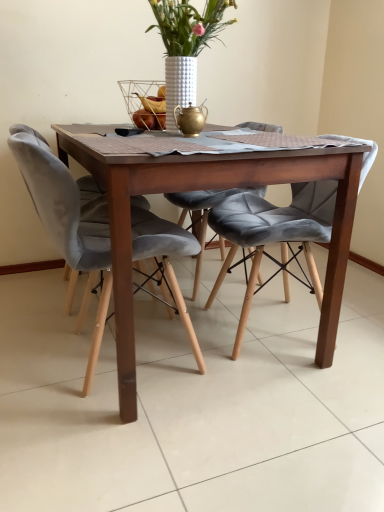
Question: Is velvet grey chair at left, the 2th chair from the right, positioned with its back to velvet grey chair at center, the first chair when ordered from right to left?

Choices:
 (A) yes
 (B) no

Answer: (B)

Question: Would you say velvet grey chair at left, the 2th chair from the right, contains velvet grey chair at center, the first chair when ordered from right to left?

Choices:
 (A) no
 (B) yes

Answer: (A)

Question: Is velvet grey chair at left, the 1th chair in the left-to-right sequence, positioned behind velvet grey chair at center, the second chair positioned from the left?

Choices:
 (A) no
 (B) yes

Answer: (A)

Question: Considering the relative sizes of velvet grey chair at left, the 1th chair in the left-to-right sequence, and velvet grey chair at center, the second chair positioned from the left, in the image provided, is velvet grey chair at left, the 1th chair in the left-to-right sequence, thinner than velvet grey chair at center, the second chair positioned from the left,?

Choices:
 (A) no
 (B) yes

Answer: (B)

Question: Is velvet grey chair at left, the 2th chair from the right, smaller than velvet grey chair at center, the first chair when ordered from right to left?

Choices:
 (A) yes
 (B) no

Answer: (B)

Question: Considering the relative positions of velvet grey chair at left, the 2th chair from the right, and velvet grey chair at center, the second chair positioned from the left, in the image provided, is velvet grey chair at left, the 2th chair from the right, in front of velvet grey chair at center, the second chair positioned from the left,?

Choices:
 (A) yes
 (B) no

Answer: (A)

Question: From a real-world perspective, is velvet grey chair at center, the second chair positioned from the left, physically below velvet grey chair at left, the 2th chair from the right?

Choices:
 (A) no
 (B) yes

Answer: (B)

Question: From the image's perspective, is velvet grey chair at center, the second chair positioned from the left, under velvet grey chair at left, the 1th chair in the left-to-right sequence?

Choices:
 (A) yes
 (B) no

Answer: (B)

Question: Would you say velvet grey chair at center, the second chair positioned from the left, is outside velvet grey chair at left, the 2th chair from the right?

Choices:
 (A) no
 (B) yes

Answer: (B)

Question: Does velvet grey chair at center, the first chair when ordered from right to left, appear on the left side of velvet grey chair at left, the 1th chair in the left-to-right sequence?

Choices:
 (A) no
 (B) yes

Answer: (A)

Question: Can you confirm if velvet grey chair at center, the first chair when ordered from right to left, is bigger than velvet grey chair at left, the 2th chair from the right?

Choices:
 (A) yes
 (B) no

Answer: (B)

Question: Is velvet grey chair at center, the second chair positioned from the left, looking in the opposite direction of velvet grey chair at left, the 2th chair from the right?

Choices:
 (A) yes
 (B) no

Answer: (B)

Question: From a real-world perspective, is white textured vase at upper center on wooden table at center?

Choices:
 (A) yes
 (B) no

Answer: (A)